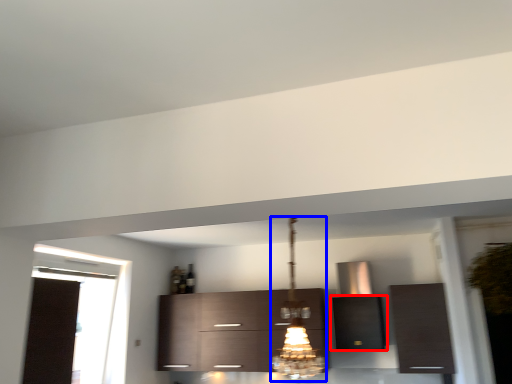
Question: Which point is further to the camera, cabinetry (highlighted by a red box) or light fixture (highlighted by a blue box)?

Choices:
 (A) cabinetry
 (B) light fixture

Answer: (A)